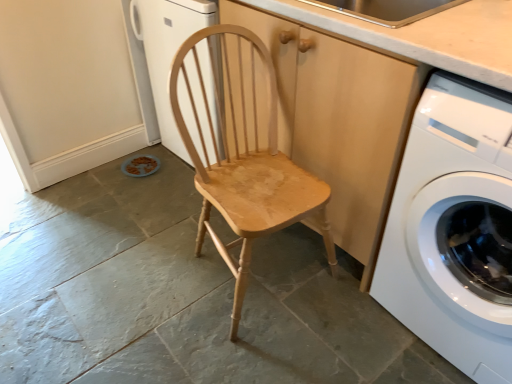
Question: From their relative heights in the image, would you say light brown wood at upper center is taller or shorter than natural wood chair at center?

Choices:
 (A) short
 (B) tall

Answer: (A)

Question: From the image's perspective, is light brown wood at upper center above or below natural wood chair at center?

Choices:
 (A) above
 (B) below

Answer: (A)

Question: Which object is positioned closest to the natural wood chair at center?

Choices:
 (A) light brown wood at upper center
 (B) wooden cabinet at center
 (C) white glossy washing machine at right

Answer: (B)

Question: Which of these objects is positioned closest to the wooden cabinet at center?

Choices:
 (A) natural wood chair at center
 (B) light brown wood at upper center
 (C) white glossy washing machine at right

Answer: (A)